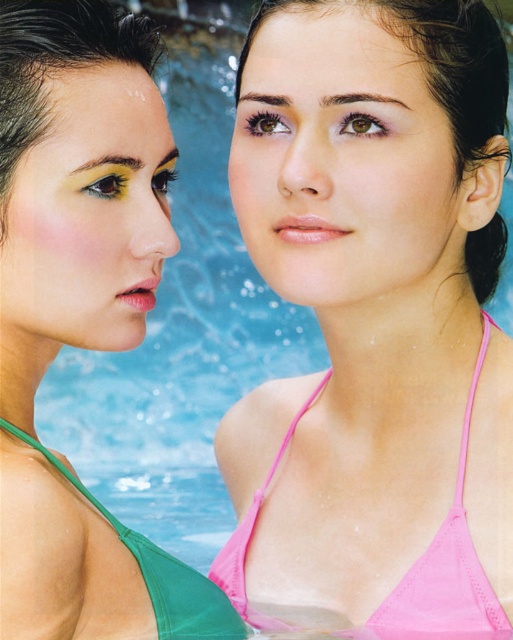
Between matte pink bikini top at upper right and matte yellow eye makeup at left, which one appears on the right side from the viewer's perspective?

Positioned to the right is matte pink bikini top at upper right.

The height and width of the screenshot is (640, 513). In order to click on matte pink bikini top at upper right in this screenshot , I will do `click(343, 157)`.

Which is more to the right, matte pink bikini top at upper right or green matte bikini top at lower left?

Positioned to the right is matte pink bikini top at upper right.

Which is in front, point (334, 154) or point (205, 588)?

Point (205, 588) is in front.

Is point (430, 230) more distant than point (195, 592)?

Yes, it is behind point (195, 592).

Locate an element on the screen. matte pink bikini top at upper right is located at coordinates (343, 157).

Based on the photo, who is more forward, (323, 266) or (230, 595)?

Positioned in front is point (323, 266).

Between matte pink bikini top at upper right and pink fabric bikini top at center, which one is positioned lower?

Positioned lower is pink fabric bikini top at center.

Does point (345, 266) come closer to viewer compared to point (254, 621)?

Yes, point (345, 266) is in front of point (254, 621).

Locate an element on the screen. This screenshot has height=640, width=513. matte pink bikini top at upper right is located at coordinates (343, 157).